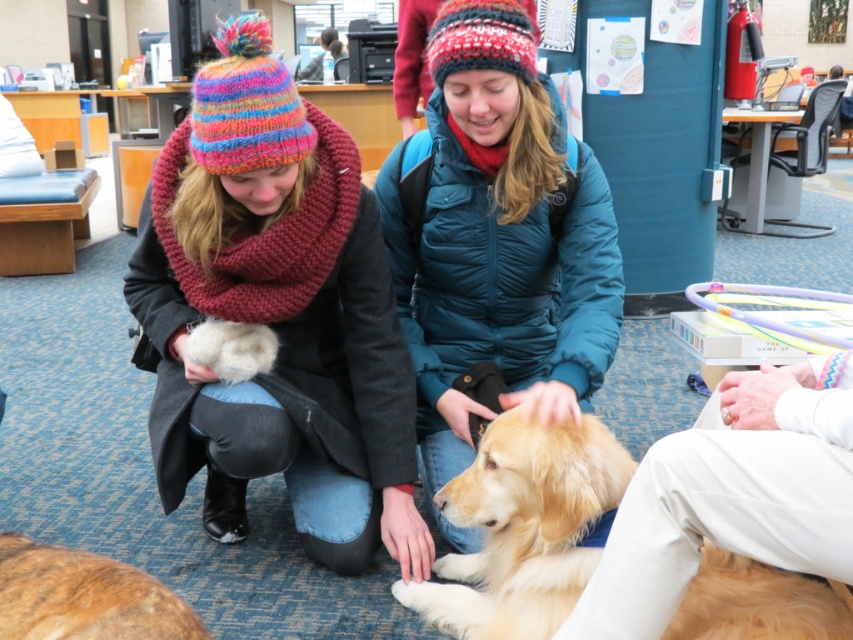
You are a photographer standing at the camera position. You want to hand the matte teal jacket at center to the person sitting on the floor. Can you reach them without moving from the camera position?

The matte teal jacket at center and camera are 1.79 meters apart. The average human arm length is about 0.7 meters, so you cannot reach the matte teal jacket at center from the camera position without moving.

You are a photographer trying to capture a clear photo of both golden fur dogs. Since the golden fur dog at lower left is behind golden fur dog at center, will you need to adjust your camera angle to see both dogs fully?

Yes, since the golden fur dog at lower left is behind golden fur dog at center, you may need to adjust your camera angle to ensure both are visible without one blocking the other.